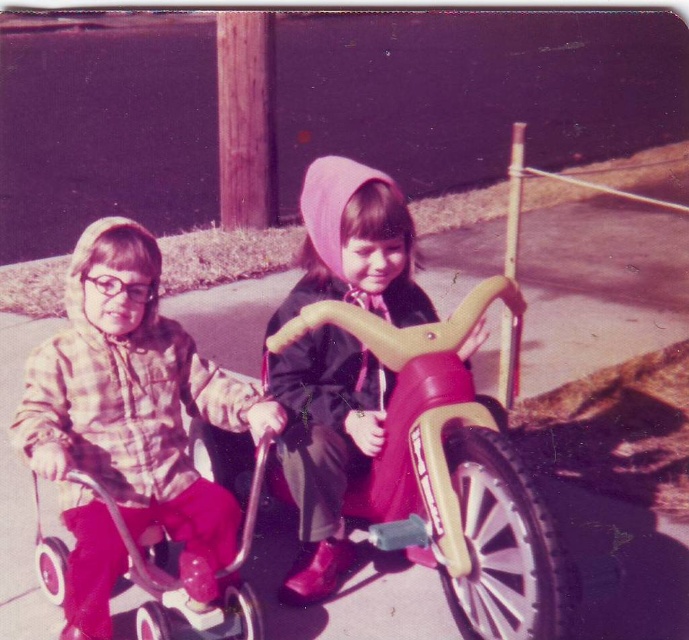
Can you confirm if plaid fabric shirt at left is positioned below matte yellow tricycle at center?

Correct, plaid fabric shirt at left is located below matte yellow tricycle at center.

Who is more forward, (178, 525) or (327, 198)?

Point (327, 198) is in front.

Measure the distance between plaid fabric shirt at left and camera.

A distance of 6.05 feet exists between plaid fabric shirt at left and camera.

The width and height of the screenshot is (689, 640). What are the coordinates of `plaid fabric shirt at left` in the screenshot? It's located at (130, 426).